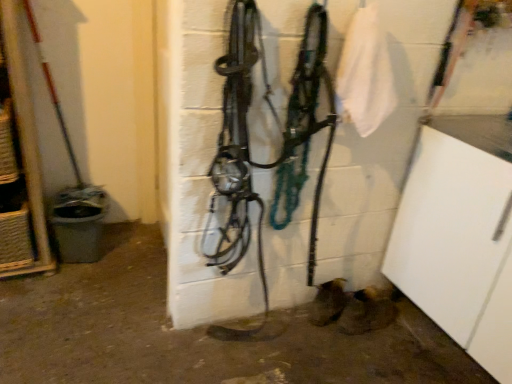
The image size is (512, 384). I want to click on brown suede boot at lower center, so click(368, 311).

Measure the distance between point (361, 313) and camera.

A distance of 1.81 meters exists between point (361, 313) and camera.

Describe the element at coordinates (368, 311) in the screenshot. I see `brown suede boot at lower center` at that location.

Where is `brown suede boot at lower center`? The width and height of the screenshot is (512, 384). brown suede boot at lower center is located at coordinates (368, 311).